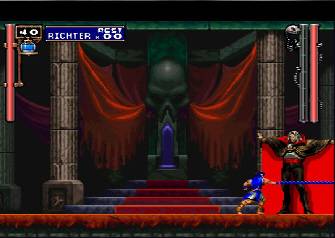
Find the location of a particular element. The height and width of the screenshot is (238, 335). throne is located at coordinates (167, 156).